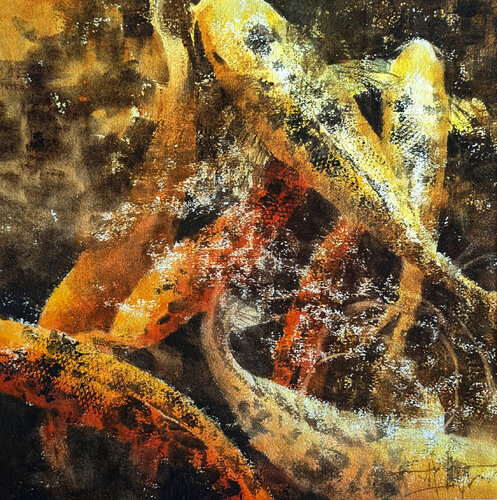
Identify the location of painting. This screenshot has width=497, height=500. (242, 206).